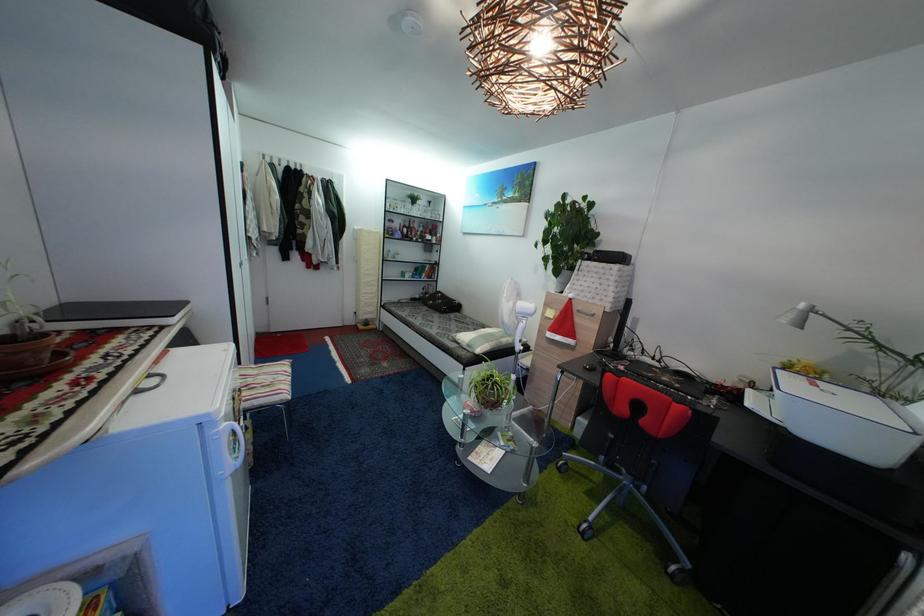
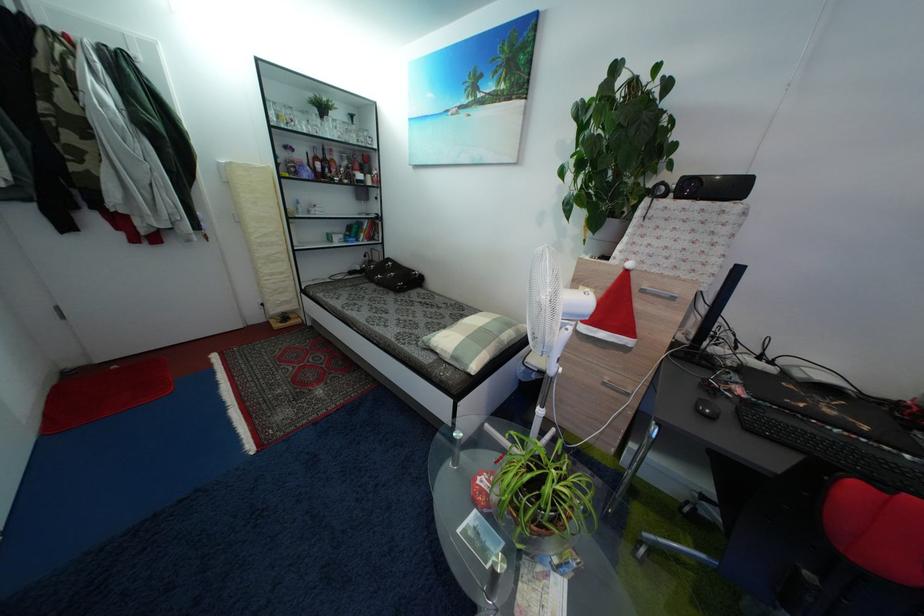
Question: Which direction would the cameraman need to move to produce the second image? Reply with the corresponding letter.

Choices:
 (A) Left
 (B) Right
 (C) Forward
 (D) Backward

Answer: (C)